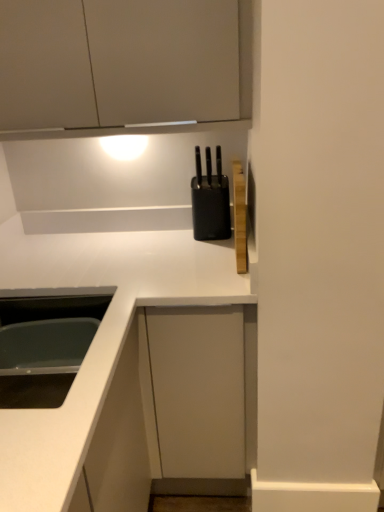
Question: Considering their positions, is matte gray cabinet at upper left located in front of or behind black plastic knife block at upper center?

Choices:
 (A) front
 (B) behind

Answer: (A)

Question: Is point (144, 4) positioned closer to the camera than point (218, 207)?

Choices:
 (A) farther
 (B) closer

Answer: (B)

Question: Considering the real-world distances, which object is farthest from the white glossy countertop at center?

Choices:
 (A) black plastic knife block at upper center
 (B) white glossy sink at lower left
 (C) matte gray cabinet at upper left

Answer: (C)

Question: Which object is positioned farthest from the white glossy countertop at center?

Choices:
 (A) matte gray cabinet at upper left
 (B) white glossy sink at lower left
 (C) black plastic knife block at upper center

Answer: (A)